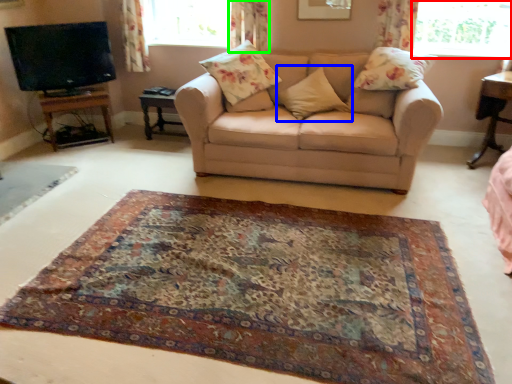
Question: Estimate the real-world distances between objects in this image. Which object is farther from window (highlighted by a red box), pillow (highlighted by a blue box) or curtain (highlighted by a green box)?

Choices:
 (A) pillow
 (B) curtain

Answer: (B)